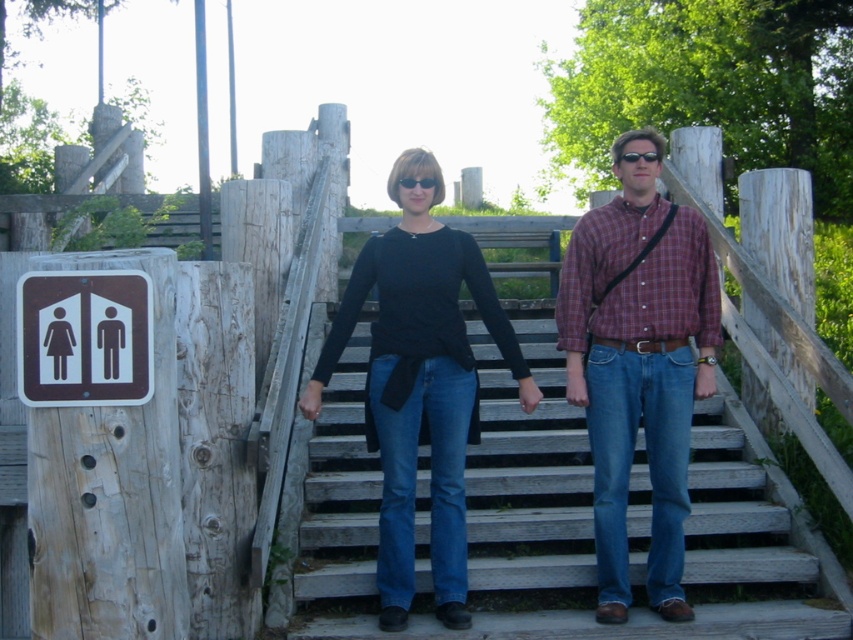
Between point (541, 428) and point (27, 305), which one is positioned behind?

The point (541, 428) is more distant.

Is wooden stairs at center further to camera compared to brown plastic sign at left?

Yes, wooden stairs at center is further from the viewer.

Which is in front, point (759, 513) or point (80, 336)?

Point (80, 336)

The width and height of the screenshot is (853, 640). I want to click on wooden stairs at center, so click(x=560, y=518).

Is matte black shirt at center to the left of brown plastic sign at left from the viewer's perspective?

Incorrect, matte black shirt at center is not on the left side of brown plastic sign at left.

Find the location of a particular element. The image size is (853, 640). matte black shirt at center is located at coordinates (421, 381).

The width and height of the screenshot is (853, 640). Find the location of `matte black shirt at center`. matte black shirt at center is located at coordinates (421, 381).

Between wooden stairs at center and plaid cotton shirt at center, which one is positioned higher?

plaid cotton shirt at center

Who is taller, wooden stairs at center or plaid cotton shirt at center?

Standing taller between the two is plaid cotton shirt at center.

Between point (364, 490) and point (582, 259), which one is positioned in front?

Point (582, 259)

I want to click on wooden stairs at center, so [560, 518].